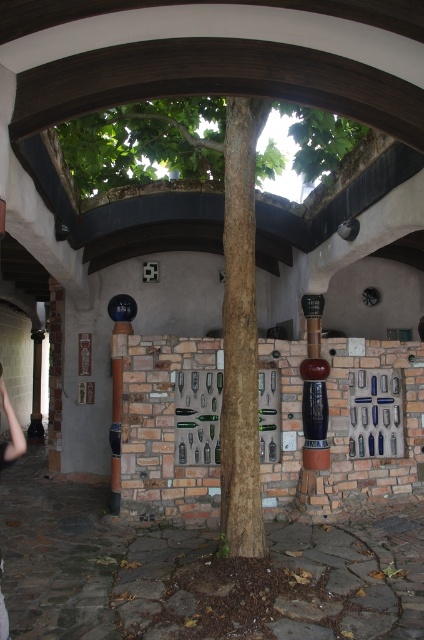
Question: Which of the following is the farthest from the observer?

Choices:
 (A) green leafy tree at center
 (B) shiny dark wood pillar at center
 (C) skinny jeans at lower left

Answer: (B)

Question: Which object is the closest to the skinny jeans at lower left?

Choices:
 (A) green leafy tree at center
 (B) shiny dark wood pillar at center

Answer: (B)

Question: Which point is closer to the camera?

Choices:
 (A) shiny dark wood pillar at center
 (B) skinny jeans at lower left
 (C) green leafy tree at center

Answer: (B)

Question: Is green leafy tree at center positioned before skinny jeans at lower left?

Choices:
 (A) no
 (B) yes

Answer: (A)

Question: Is shiny dark wood pillar at center to the right of skinny jeans at lower left from the viewer's perspective?

Choices:
 (A) no
 (B) yes

Answer: (B)

Question: Does shiny dark wood pillar at center have a larger size compared to skinny jeans at lower left?

Choices:
 (A) no
 (B) yes

Answer: (B)